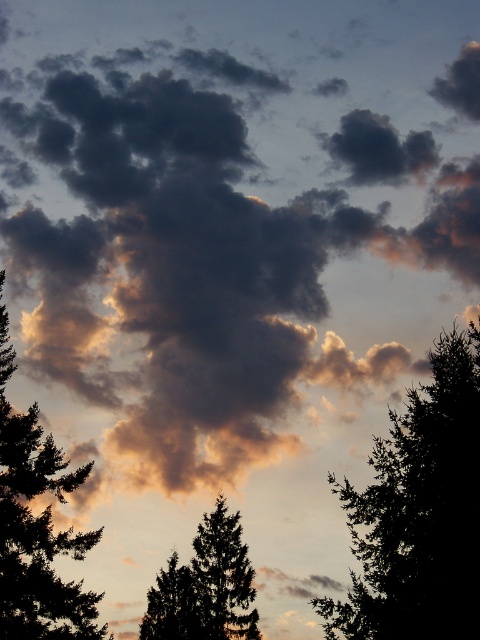
Question: Which point is closer to the camera?

Choices:
 (A) silhouette evergreen tree at left
 (B) silhouette tree at upper center

Answer: (B)

Question: Is silhouette tree at upper center positioned before green textured tree at center?

Choices:
 (A) yes
 (B) no

Answer: (A)

Question: Which point is farther to the camera?

Choices:
 (A) (232, 584)
 (B) (405, 460)

Answer: (A)

Question: Is silhouette tree at upper center smaller than silhouette evergreen tree at left?

Choices:
 (A) yes
 (B) no

Answer: (A)

Question: Which object is positioned farthest from the silhouette evergreen tree at left?

Choices:
 (A) green textured tree at center
 (B) silhouette tree at upper center

Answer: (B)

Question: Considering the relative positions of silhouette evergreen tree at left and green textured tree at center in the image provided, where is silhouette evergreen tree at left located with respect to green textured tree at center?

Choices:
 (A) right
 (B) left

Answer: (B)